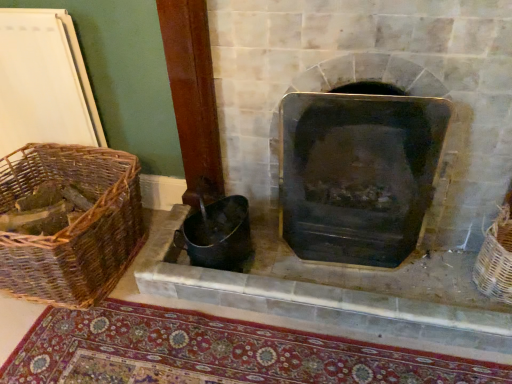
Question: Does point (230, 19) appear closer or farther from the camera than point (60, 360)?

Choices:
 (A) closer
 (B) farther

Answer: (B)

Question: Is black metal fireplace at center taller or shorter than carpeted mat at lower center?

Choices:
 (A) short
 (B) tall

Answer: (B)

Question: Which object is the farthest from the carpeted mat at lower center?

Choices:
 (A) woven brown basket at left, placed as the first basket when sorted from left to right
 (B) black matte wood burning stove at center
 (C) woven wicker basket at right, the 2th basket positioned from the left
 (D) black metal fireplace at center

Answer: (C)

Question: Based on their relative distances, which object is farther from the woven wicker basket at right, arranged as the 1th basket when viewed from the right?

Choices:
 (A) black matte wood burning stove at center
 (B) black metal fireplace at center
 (C) carpeted mat at lower center
 (D) woven brown basket at left, placed as the first basket when sorted from left to right

Answer: (D)